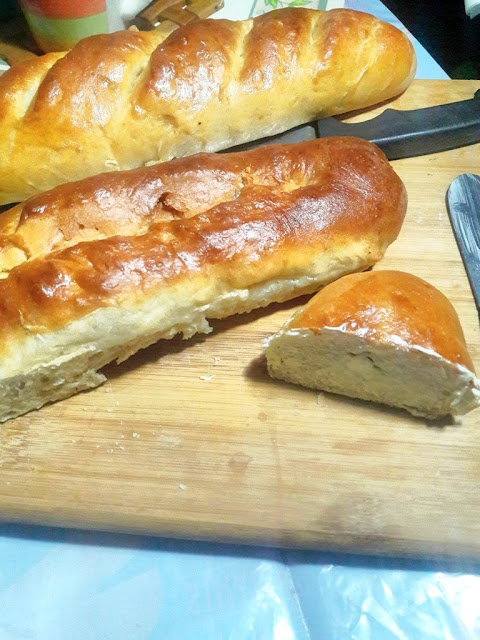
You are a GUI agent. You are given a task and a screenshot of the screen. Output one action in this format:
    pyautogui.click(x=<x>, y=<y>)
    Task: Click on the spoon
    This screenshot has width=480, height=640.
    Given the screenshot: What is the action you would take?
    pyautogui.click(x=465, y=201)